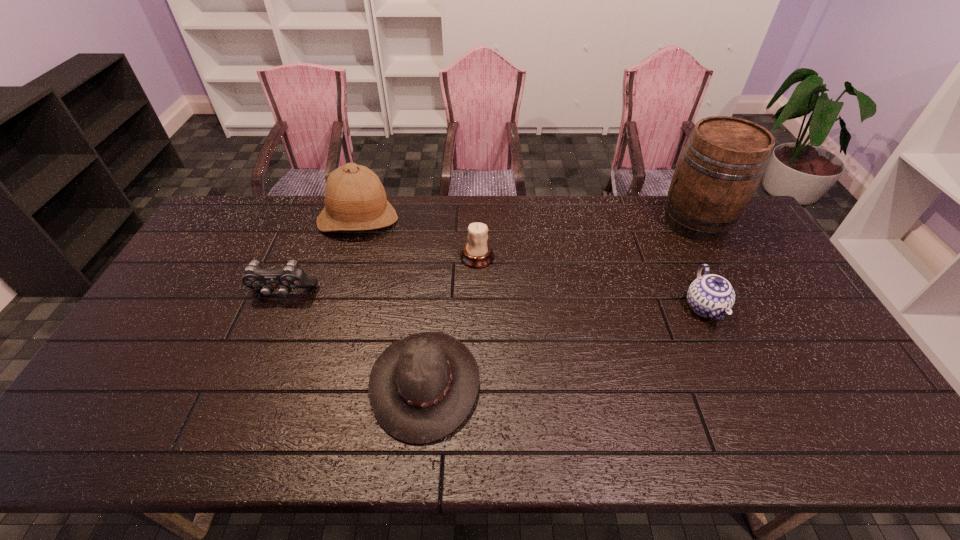
Find the location of `vacant position in the image that satisfies the following two spatial constraints: 1. at the spout of the chinaware; 2. on the front-facing side of the shorter hat`. vacant position in the image that satisfies the following two spatial constraints: 1. at the spout of the chinaware; 2. on the front-facing side of the shorter hat is located at coordinates (739, 383).